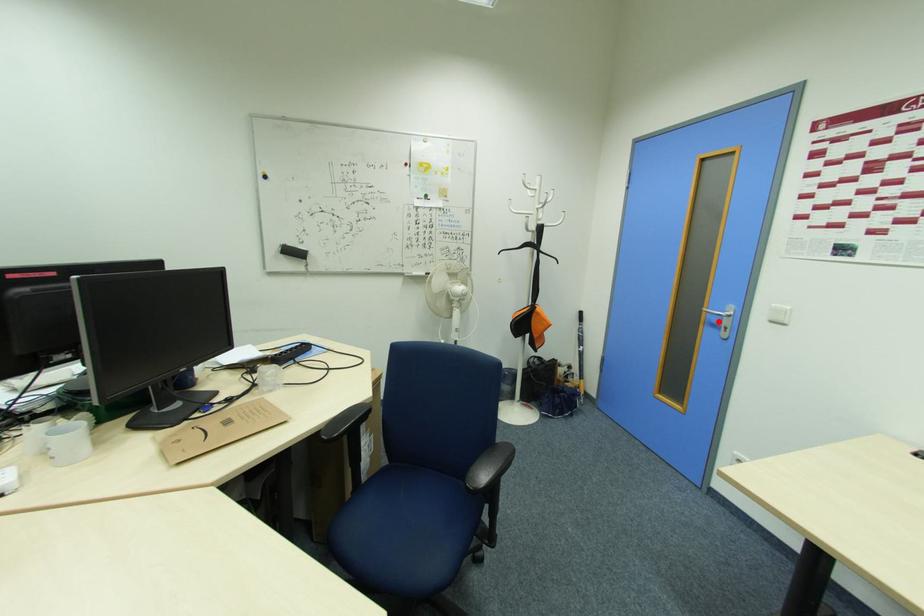
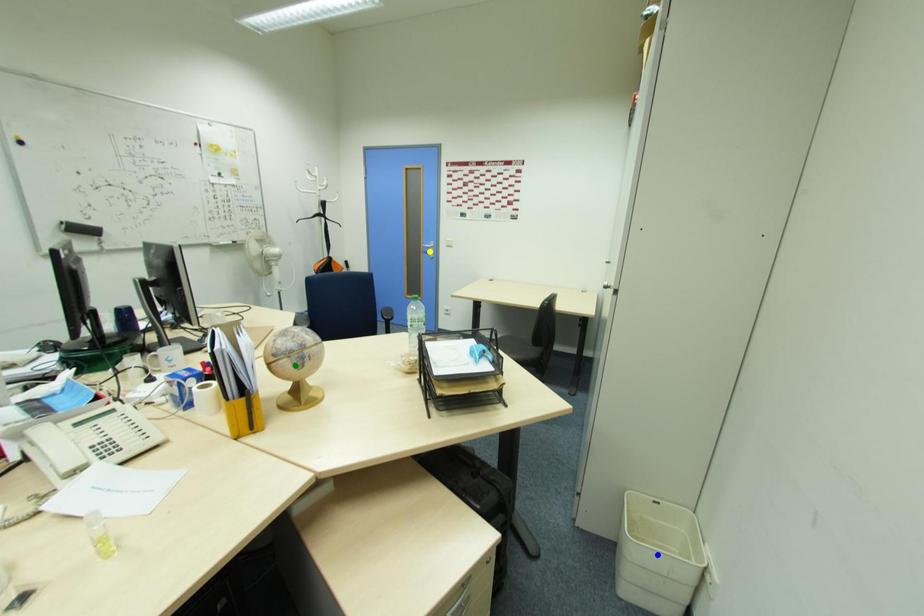
Question: I am providing you with two images of the same scene from different viewpoints. A red point is marked on the first image. You are given multiple points on the second image. Which point in image 2 is actually the same real-world point as the red point in image 1?

Choices:
 (A) yellow point
 (B) blue point
 (C) green point

Answer: (A)